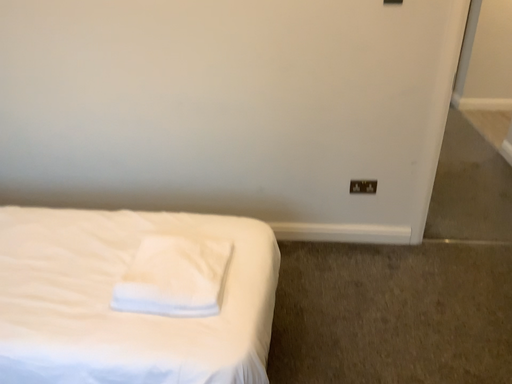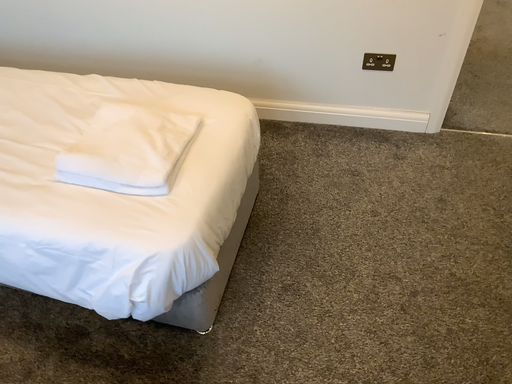
Question: Which way did the camera rotate in the video?

Choices:
 (A) rotated downward
 (B) rotated upward

Answer: (A)